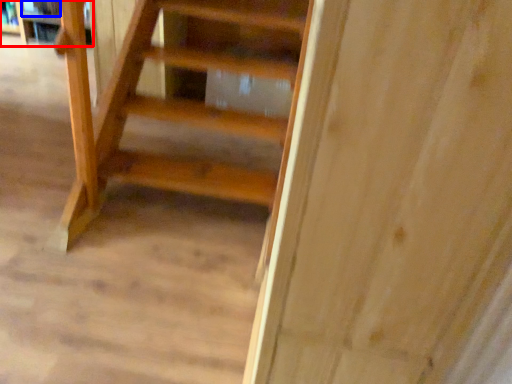
Question: Which point is further to the camera, shelf (highlighted by a red box) or book (highlighted by a blue box)?

Choices:
 (A) shelf
 (B) book

Answer: (B)